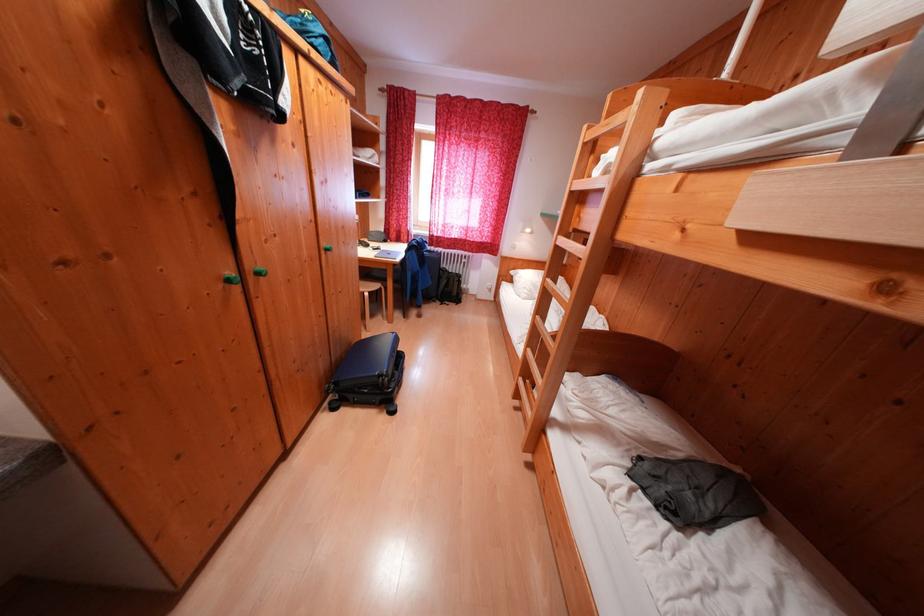
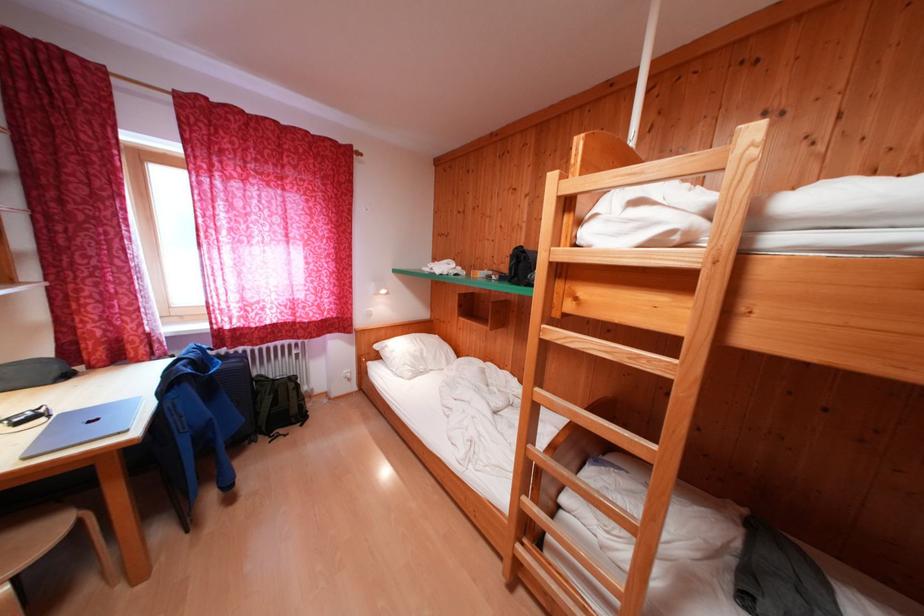
Question: The camera is either moving clockwise (left) or counter-clockwise (right) around the object. The first image is from the beginning of the video and the second image is from the end. Is the camera moving left or right when shooting the video?

Choices:
 (A) Left
 (B) Right

Answer: (A)